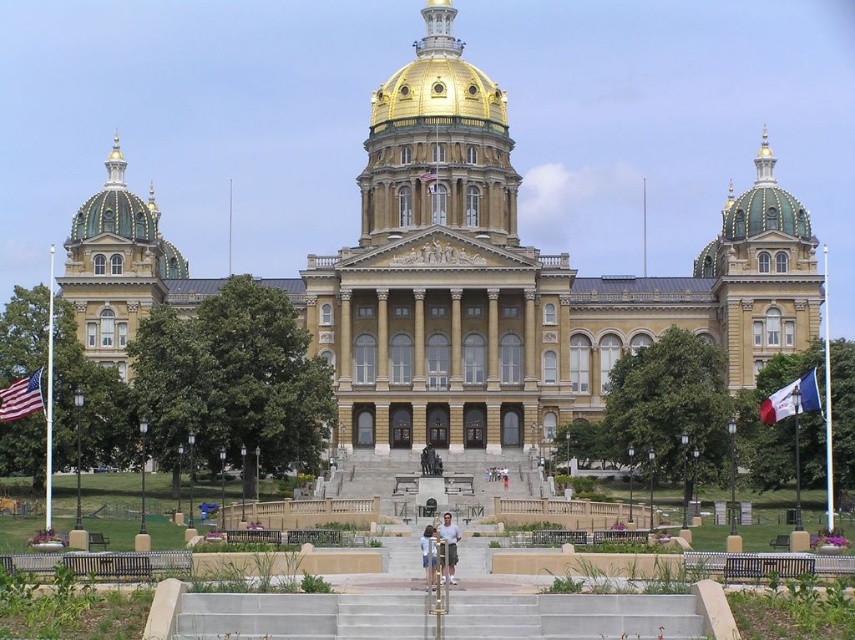
Question: Which object is farther from the camera taking this photo?

Choices:
 (A) american flag at left
 (B) gray concrete stairs at center
 (C) gold/golden stone building at center
 (D) gold polished dome at center

Answer: (D)

Question: Does gold polished dome at center come in front of light brown shorts at center?

Choices:
 (A) yes
 (B) no

Answer: (B)

Question: Which of the following is the closest to the observer?

Choices:
 (A) gray concrete stairs at center
 (B) light blue denim shorts at center

Answer: (A)

Question: Is gold/golden stone building at center closer to the viewer compared to gold polished dome at center?

Choices:
 (A) no
 (B) yes

Answer: (B)

Question: Is gold/gilded dome at upper left in front of american flag at left?

Choices:
 (A) no
 (B) yes

Answer: (A)

Question: Which of the following is the farthest from the observer?

Choices:
 (A) [x=782, y=396]
 (B) [x=437, y=42]
 (C) [x=24, y=381]
 (D) [x=808, y=214]

Answer: (B)